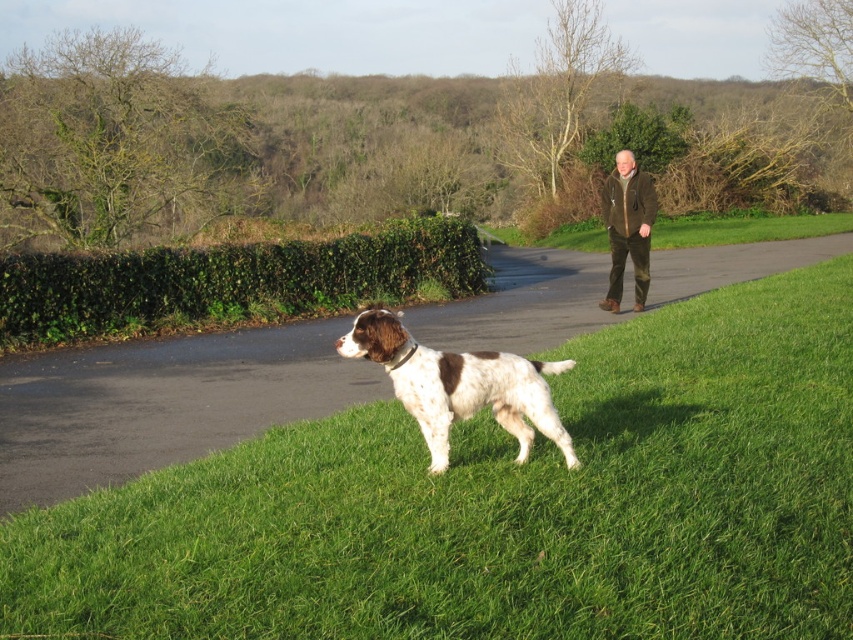
Question: Estimate the real-world distances between objects in this image. Which object is closer to the green asphalt path at center?

Choices:
 (A) brown leather jacket at upper right
 (B) brown and white speckled dog at center

Answer: (B)

Question: Does green asphalt path at center have a greater width compared to brown leather jacket at upper right?

Choices:
 (A) yes
 (B) no

Answer: (A)

Question: Can you confirm if green asphalt path at center is positioned above brown leather jacket at upper right?

Choices:
 (A) no
 (B) yes

Answer: (B)

Question: Which object is the farthest from the green asphalt path at center?

Choices:
 (A) brown leather jacket at upper right
 (B) green leafy hedge at center
 (C) brown and white speckled dog at center

Answer: (A)

Question: Is green leafy hedge at center thinner than brown leather jacket at upper right?

Choices:
 (A) yes
 (B) no

Answer: (B)

Question: Which point appears closest to the camera in this image?

Choices:
 (A) (614, 216)
 (B) (267, 410)
 (C) (136, 253)
 (D) (428, 436)

Answer: (D)